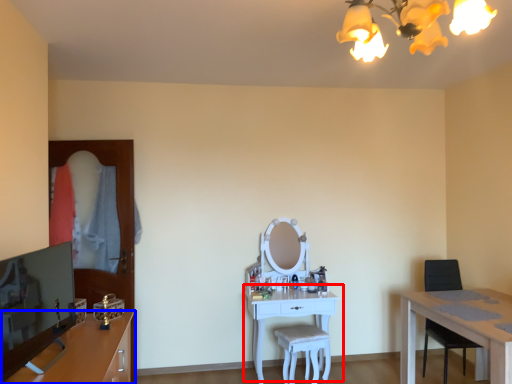
Question: Which of the following is the closest to the observer, table (highlighted by a red box) or cabinetry (highlighted by a blue box)?

Choices:
 (A) table
 (B) cabinetry

Answer: (B)